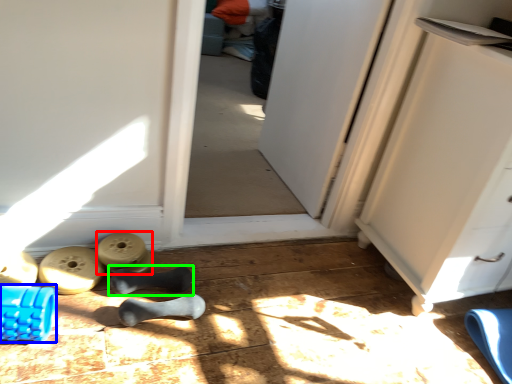
Question: Based on their relative distances, which object is farther from job (highlighted by a red box)? Choose from job (highlighted by a blue box) and footwear (highlighted by a green box).

Choices:
 (A) job
 (B) footwear

Answer: (A)